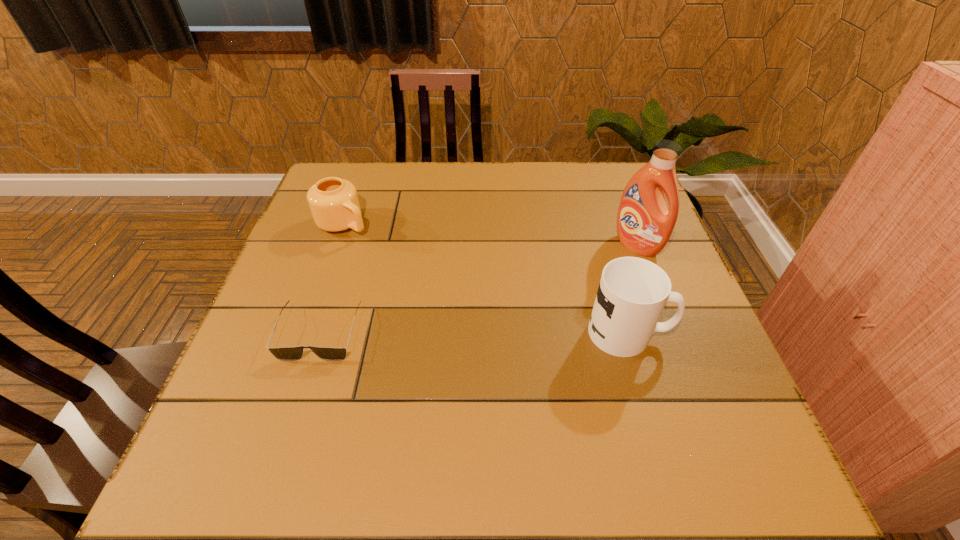
At what (x,y) coordinates should I click in order to perform the action: click on free spot on the desktop that is between the shortest object and the right mug and is positioned on the front-facing side of the tallest object. Please return your answer as a coordinate pair (x, y). Looking at the image, I should click on (509, 333).

Where is `free spot on the desktop that is between the sunglasses and the right mug and is positioned on the handle side of the farther mug`? The height and width of the screenshot is (540, 960). free spot on the desktop that is between the sunglasses and the right mug and is positioned on the handle side of the farther mug is located at coordinates (505, 333).